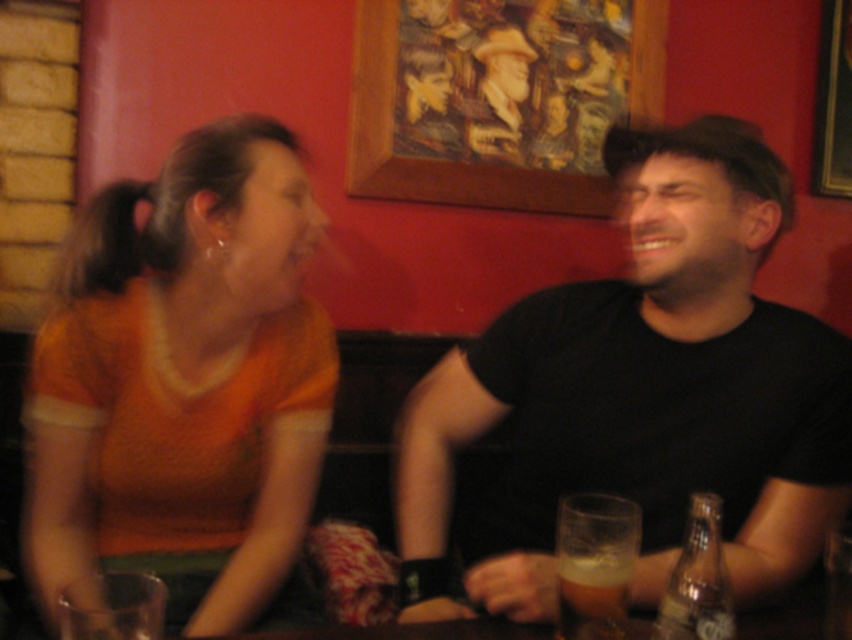
Question: Among these objects, which one is nearest to the camera?

Choices:
 (A) orange jersey at left
 (B) black matte shirt at center

Answer: (B)

Question: Estimate the real-world distances between objects in this image. Which object is closer to the orange jersey at left?

Choices:
 (A) foamy amber beer at lower center
 (B) black matte shirt at center

Answer: (B)

Question: Which point is farther to the camera?

Choices:
 (A) orange jersey at left
 (B) foamy amber beer at lower center

Answer: (A)

Question: Does black matte shirt at center have a smaller size compared to orange jersey at left?

Choices:
 (A) yes
 (B) no

Answer: (B)

Question: Is black matte shirt at center positioned in front of orange jersey at left?

Choices:
 (A) no
 (B) yes

Answer: (B)

Question: Is orange jersey at left bigger than foamy amber beer at lower center?

Choices:
 (A) yes
 (B) no

Answer: (A)